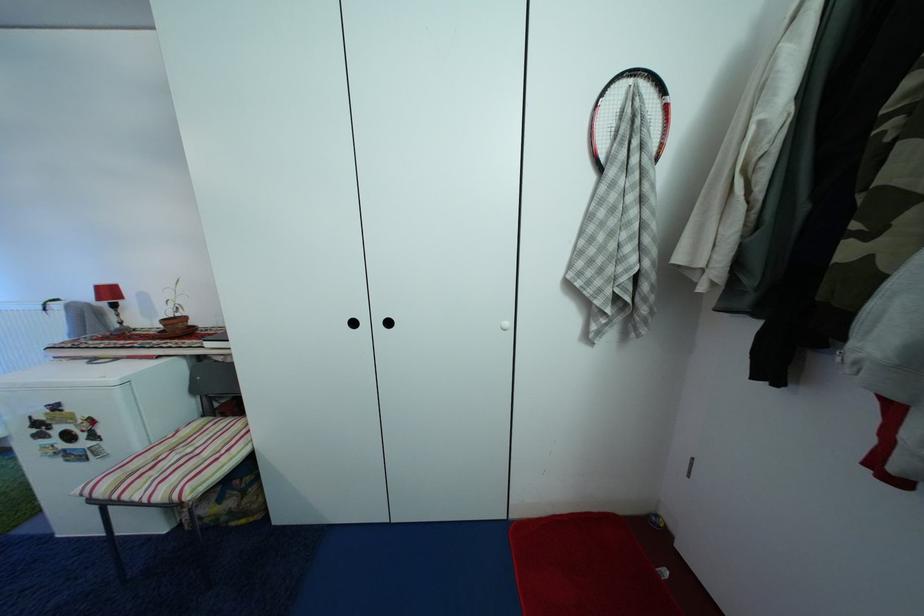
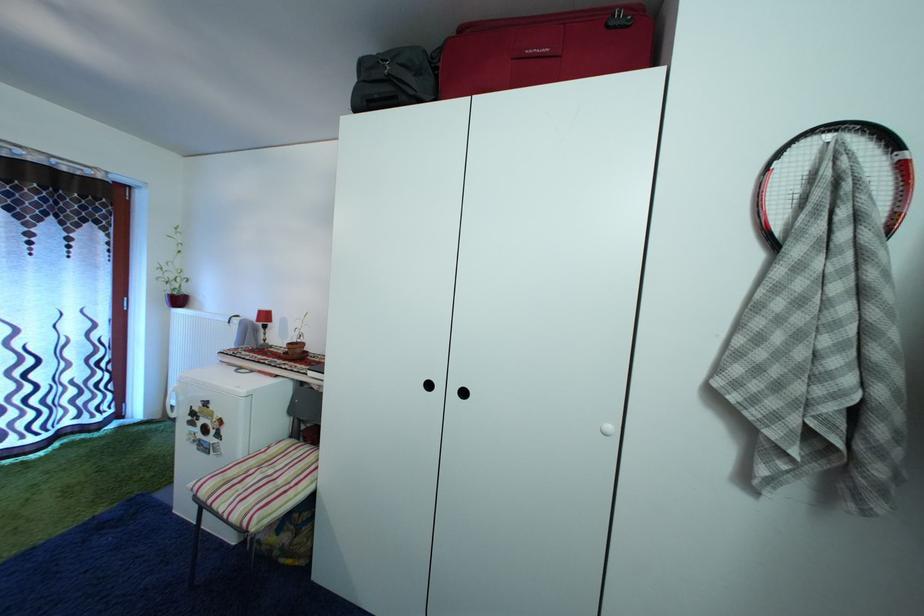
Question: Based on the continuous images, in which direction is the camera rotating? Reply with the corresponding letter.

Choices:
 (A) Left
 (B) Right
 (C) Up
 (D) Down

Answer: (A)